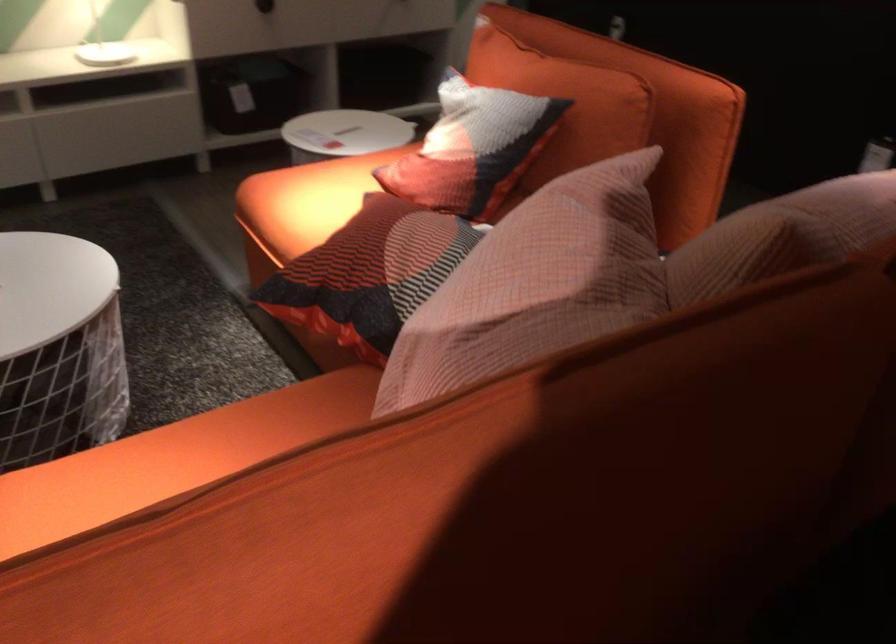
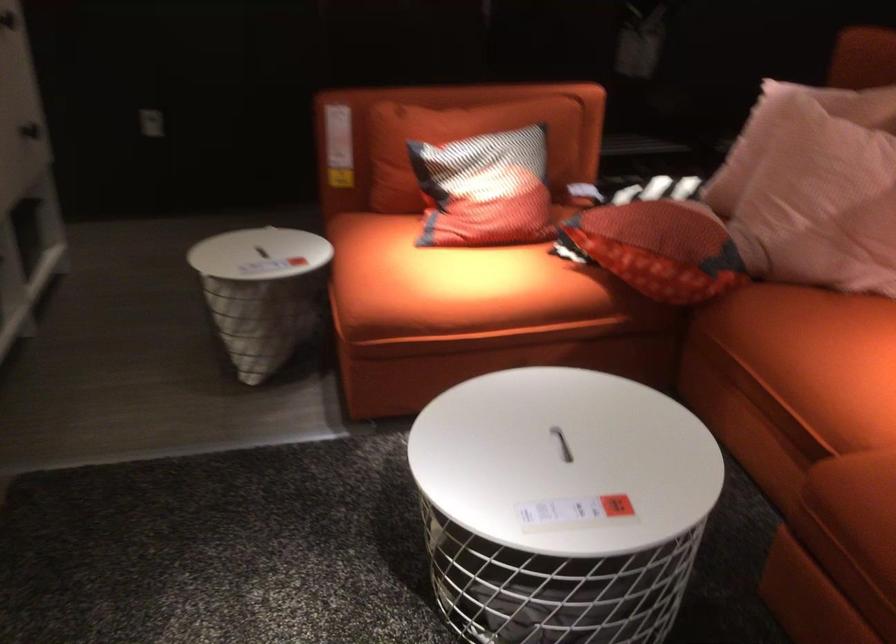
The point at (x=316, y=205) is marked in the first image. Where is the corresponding point in the second image?

(449, 281)